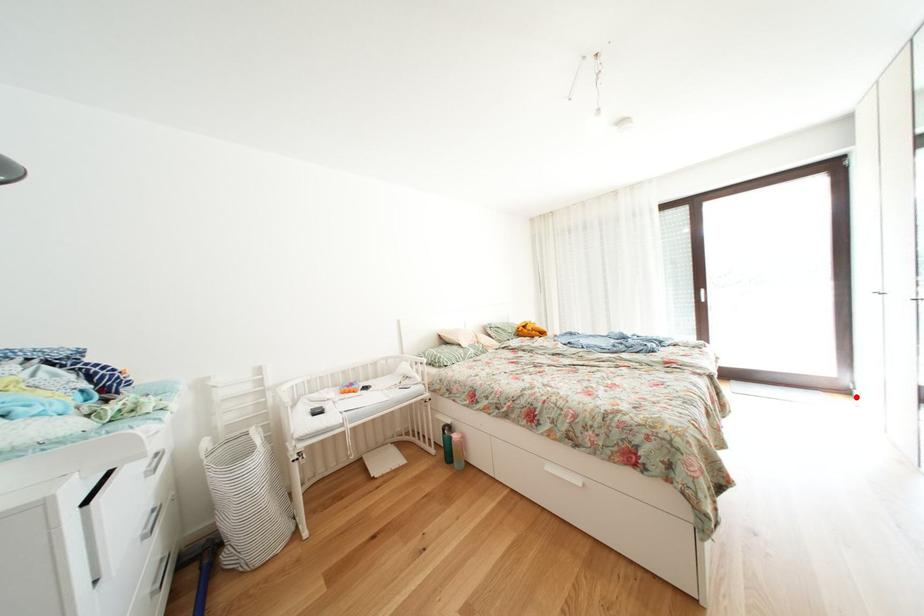
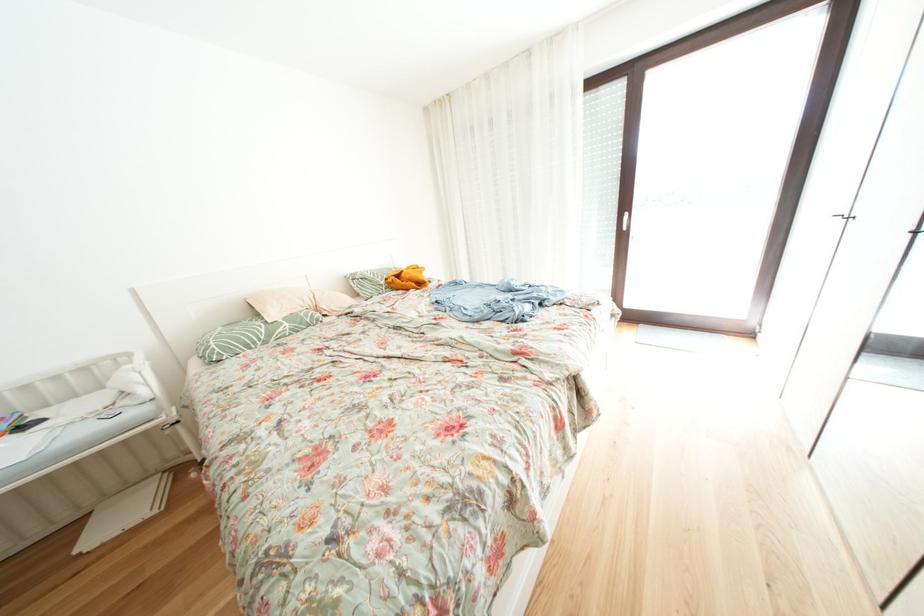
Locate, in the second image, the point that corresponds to the highlighted location in the first image.

(759, 339)